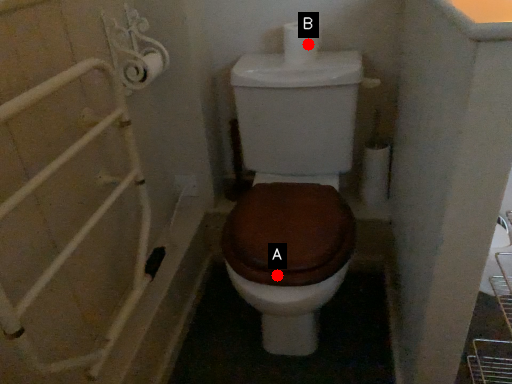
Question: Two points are circled on the image, labeled by A and B beside each circle. Which point appears closest to the camera in this image?

Choices:
 (A) A is closer
 (B) B is closer

Answer: (A)